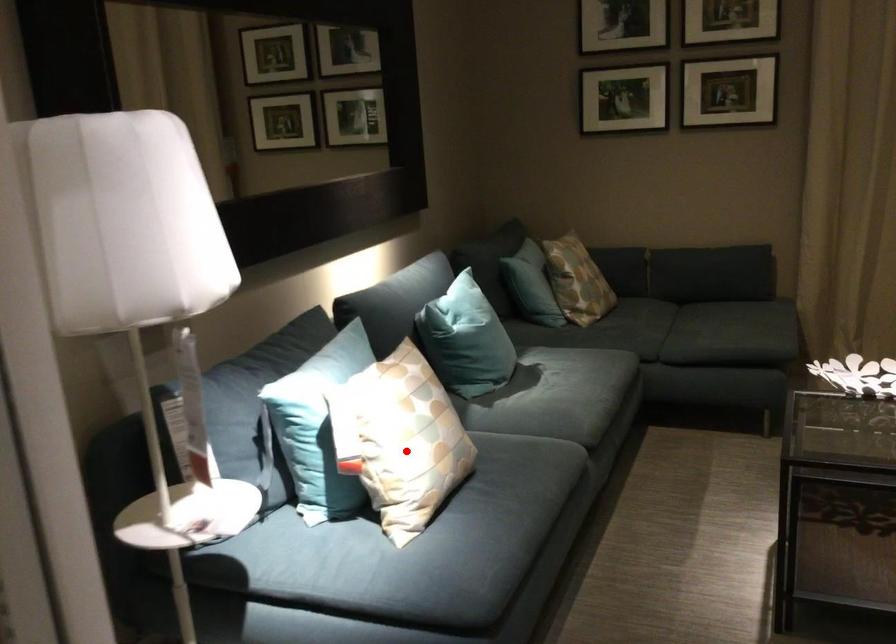
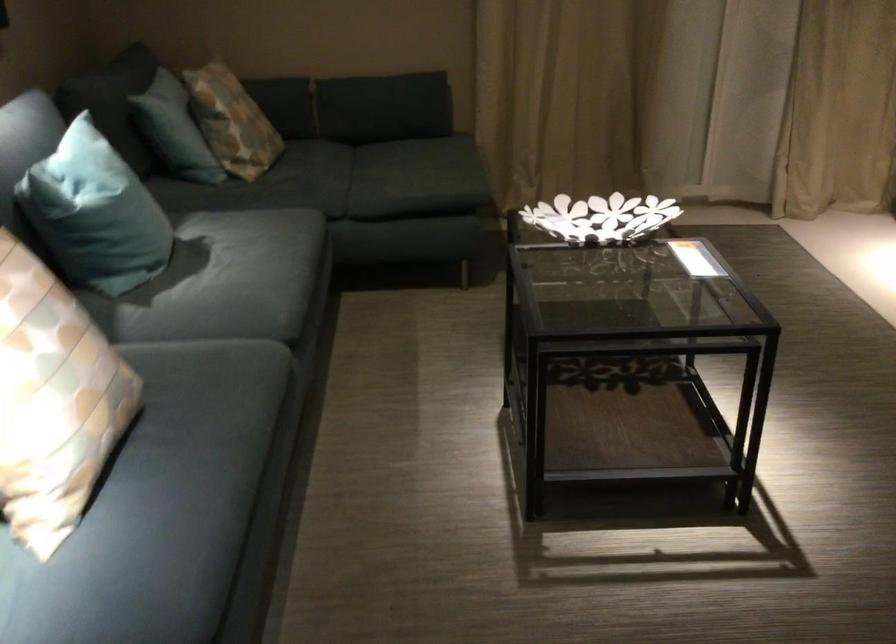
Locate, in the second image, the point that corresponds to the highlighted location in the first image.

(53, 401)